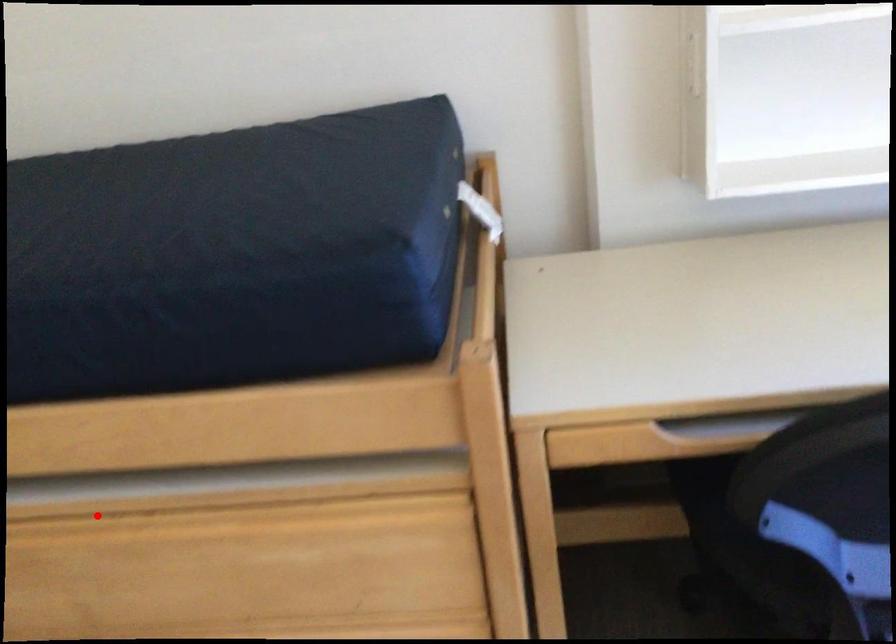
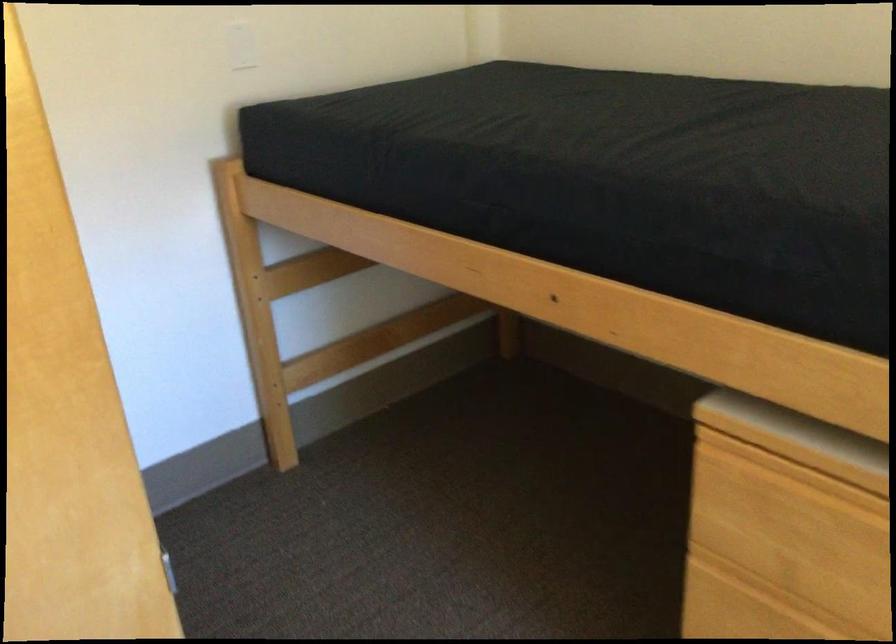
Question: A red point is marked in image1. In image2, is the corresponding 3D point closer to the camera or farther? Reply with the corresponding letter.

Choices:
 (A) The corresponding 3D point is closer.
 (B) The corresponding 3D point is farther.

Answer: (A)